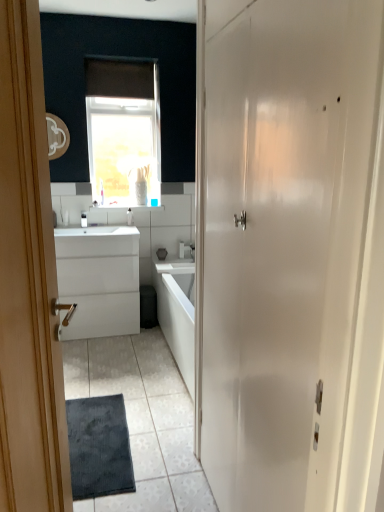
You are a GUI agent. You are given a task and a screenshot of the screen. Output one action in this format:
    pyautogui.click(x=<x>, y=<y>)
    Task: Click on the free space in front of white plastic toothbrush at upper center, which ranks as the first toiletry in right-to-left order
    This screenshot has height=512, width=384.
    Given the screenshot: What is the action you would take?
    click(119, 228)